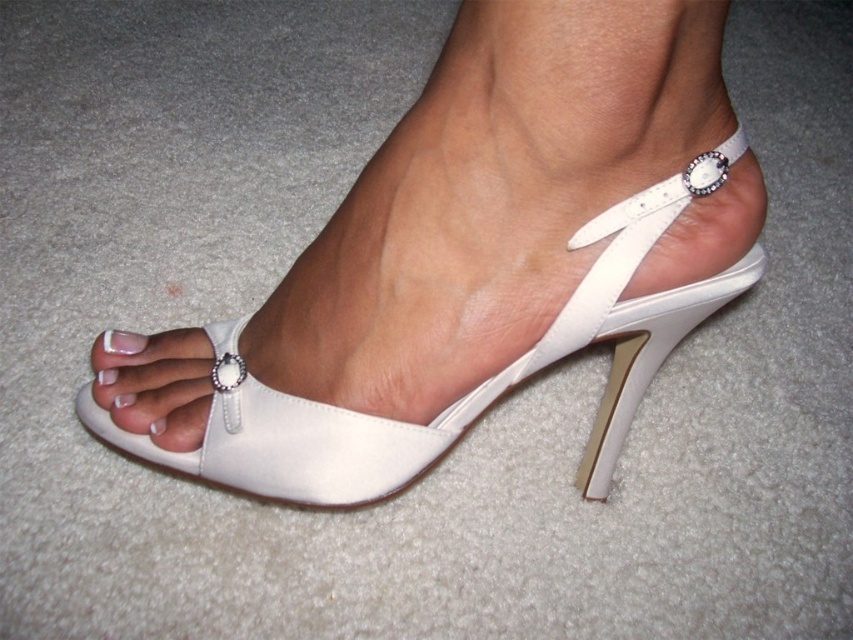
You are a photographer standing 1 meter away from the white satin sandal at center. You want to take a closeup shot of the sandal. Can you get a clear closeup without moving closer than your current position?

The distance between you and the white satin sandal at center is 60.32 centimeters, which is less than 1 meter. Since you are already closer than 1 meter, you can take a clear closeup without needing to move closer.

You are a photographer setting up a shoot. You need to position a light source to the left of the white glossy nail at center so that it casts a shadow of the white satin sandal at center onto the carpet. Is this possible given their current positions?

The white satin sandal at center is to the right of the white glossy nail at center. Since the light source is placed to the left of the white glossy nail at center, the shadow of the white satin sandal at center would be cast to the right side of the nail, making it possible to cast the shadow onto the carpet as desired.

You are a photographer setting up a shoot. You have a white satin sandal at center and a white glossy nail at center in the scene. To ensure the nail is visible in the final photo, where should you place the light source relative to the nail?

The white satin sandal at center is positioned under the white glossy nail at center. To ensure the nail is visible, place the light source above the white glossy nail at center so it illuminates the nail and creates contrast with the sandal below.